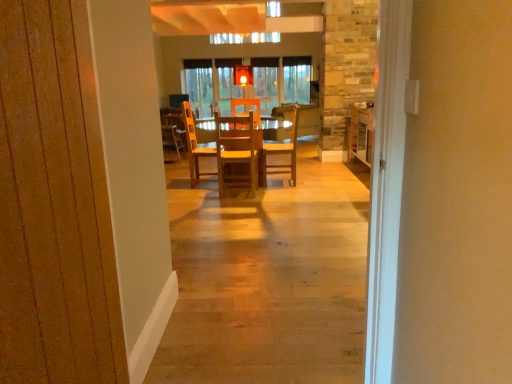
Question: Considering the relative sizes of wooden chair at center, which is counted as the 4th chair, starting from the front, and wooden at center, placed as the 3th chair when sorted from left to right, in the image provided, is wooden chair at center, which is counted as the 4th chair, starting from the front, taller than wooden at center, placed as the 3th chair when sorted from left to right,?

Choices:
 (A) no
 (B) yes

Answer: (B)

Question: Can you confirm if wooden chair at center, the 1th chair in the left-to-right sequence, is positioned to the left of wooden at center, placed as the 3th chair when sorted from left to right?

Choices:
 (A) no
 (B) yes

Answer: (B)

Question: Is wooden chair at center, arranged as the 1th chair when viewed from the back, surrounding wooden at center, the second chair when ordered from right to left?

Choices:
 (A) yes
 (B) no

Answer: (B)

Question: From the image's perspective, does wooden chair at center, arranged as the 1th chair when viewed from the back, appear lower than wooden at center, the second chair when ordered from right to left?

Choices:
 (A) yes
 (B) no

Answer: (B)

Question: Is wooden chair at center, arranged as the 1th chair when viewed from the back, not close to wooden at center, the second chair when ordered from right to left?

Choices:
 (A) yes
 (B) no

Answer: (B)

Question: Considering the positions of wooden chair at center, arranged as the 1th chair when viewed from the right, and wooden at center, which is the third chair from back to front, in the image, is wooden chair at center, arranged as the 1th chair when viewed from the right, taller or shorter than wooden at center, which is the third chair from back to front,?

Choices:
 (A) short
 (B) tall

Answer: (B)

Question: From a real-world perspective, is wooden chair at center, arranged as the 1th chair when viewed from the right, positioned above or below wooden at center, the second chair when ordered from right to left?

Choices:
 (A) above
 (B) below

Answer: (A)

Question: Does point (x=297, y=107) appear closer or farther from the camera than point (x=187, y=147)?

Choices:
 (A) farther
 (B) closer

Answer: (A)

Question: Considering the positions of wooden chair at center, arranged as the 1th chair when viewed from the right, and wooden at center, which is the third chair from back to front, in the image, is wooden chair at center, arranged as the 1th chair when viewed from the right, wider or thinner than wooden at center, which is the third chair from back to front,?

Choices:
 (A) wide
 (B) thin

Answer: (B)

Question: Does point click(x=177, y=115) appear closer or farther from the camera than point click(x=215, y=150)?

Choices:
 (A) closer
 (B) farther

Answer: (A)

Question: From a real-world perspective, is wooden chair at center, the 1th chair in the left-to-right sequence, above or below wooden at center, the second chair when ordered from right to left?

Choices:
 (A) above
 (B) below

Answer: (A)

Question: Considering the positions of wooden chair at center, which is counted as the 4th chair, starting from the front, and wooden at center, placed as the 3th chair when sorted from left to right, in the image, is wooden chair at center, which is counted as the 4th chair, starting from the front, bigger or smaller than wooden at center, placed as the 3th chair when sorted from left to right,?

Choices:
 (A) big
 (B) small

Answer: (B)

Question: In terms of height, does wooden chair at center, arranged as the 1th chair when viewed from the back, look taller or shorter compared to wooden at center, the second chair when ordered from right to left?

Choices:
 (A) short
 (B) tall

Answer: (B)

Question: From the image's perspective, is wooden at center, placed as the second chair when sorted from front to back, located above or below wooden chair at center, arranged as the 1th chair when viewed from the back?

Choices:
 (A) below
 (B) above

Answer: (A)

Question: From a real-world perspective, relative to wooden chair at center, placed as the 4th chair when sorted from right to left, is wooden at center, the second chair when ordered from right to left, vertically above or below?

Choices:
 (A) above
 (B) below

Answer: (B)